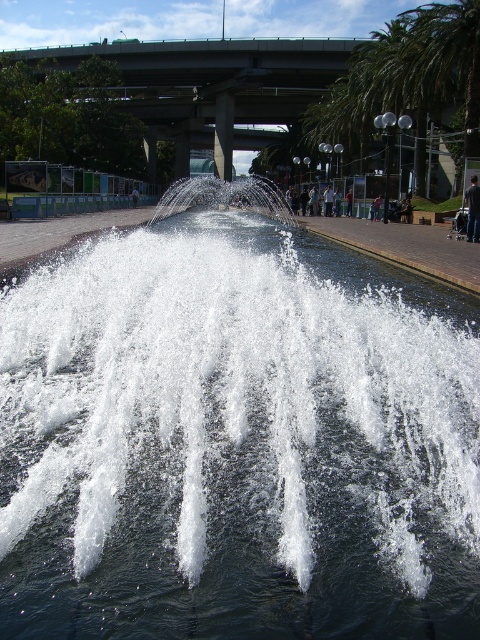
Question: Which object is the closest to the concrete bridge at upper center?

Choices:
 (A) white frothy water at center
 (B) dark gray fabric at center

Answer: (A)

Question: Estimate the real-world distances between objects in this image. Which object is farther from the concrete bridge at upper center?

Choices:
 (A) dark gray fabric at center
 (B) white frothy water at center

Answer: (A)

Question: Which point is closer to the camera?

Choices:
 (A) coord(468,204)
 (B) coord(51,342)

Answer: (B)

Question: Is concrete bridge at upper center above dark gray fabric at center?

Choices:
 (A) yes
 (B) no

Answer: (A)

Question: Can you confirm if white frothy water at center is positioned to the left of concrete bridge at upper center?

Choices:
 (A) yes
 (B) no

Answer: (B)

Question: Does white frothy water at center lie in front of concrete bridge at upper center?

Choices:
 (A) no
 (B) yes

Answer: (B)